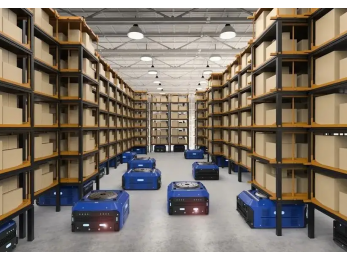
At what (x,y) coordinates should I click in order to perform the action: click on right side shelving unit. Please return your answer as a coordinate pair (x, y). The image size is (347, 260). Looking at the image, I should click on (256, 102).